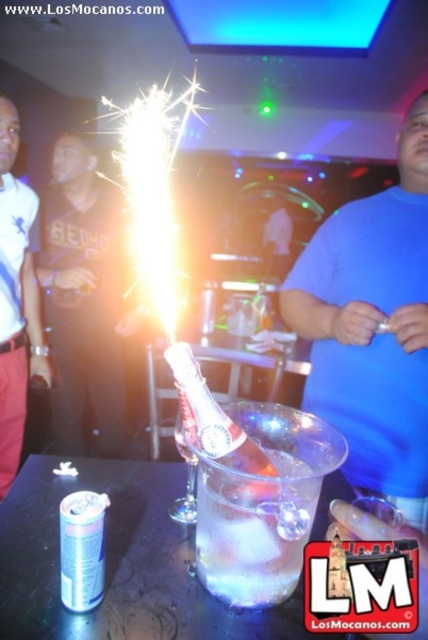
You are at a party and see the brushed metal shirt at left and the clear glass bottle at center. Which object is taller?

The brushed metal shirt at left is taller than the clear glass bottle at center.

You are at a party and want to place a rectangular gift box that is 1 meter wide on the table. The blue matte shirt at center and the clear glass ice bucket at center are on the table. Can the gift box fit between them without moving either object?

The blue matte shirt at center is wider than the clear glass ice bucket at center. Since the gift box is 1 meter wide, you need to check if the space between them can accommodate it. However, without knowing the exact distance between the shirt and the bucket, we cannot confirm if the gift box will fit. Please measure the space between them first.